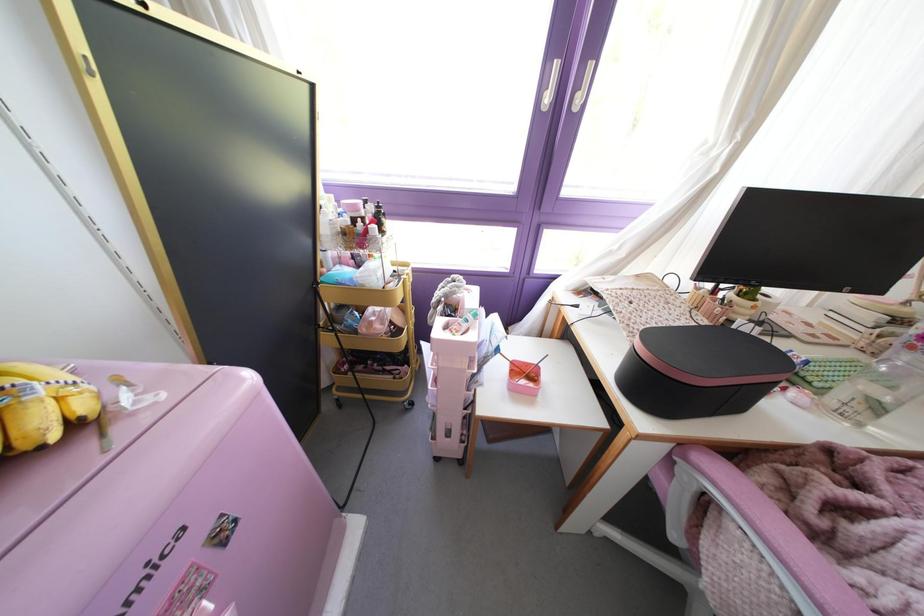
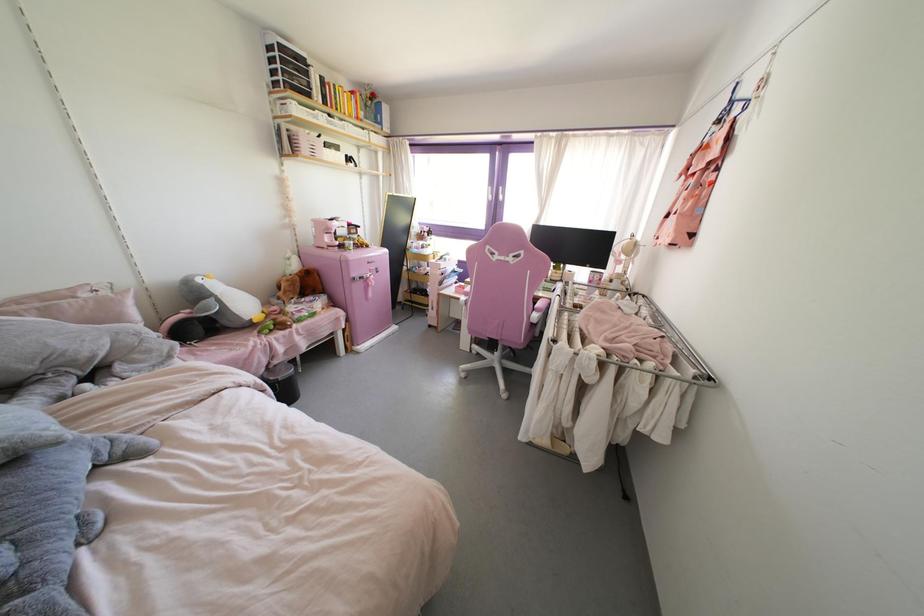
What movement of the cameraman would produce the second image?

The cameraman moved toward right, backward.